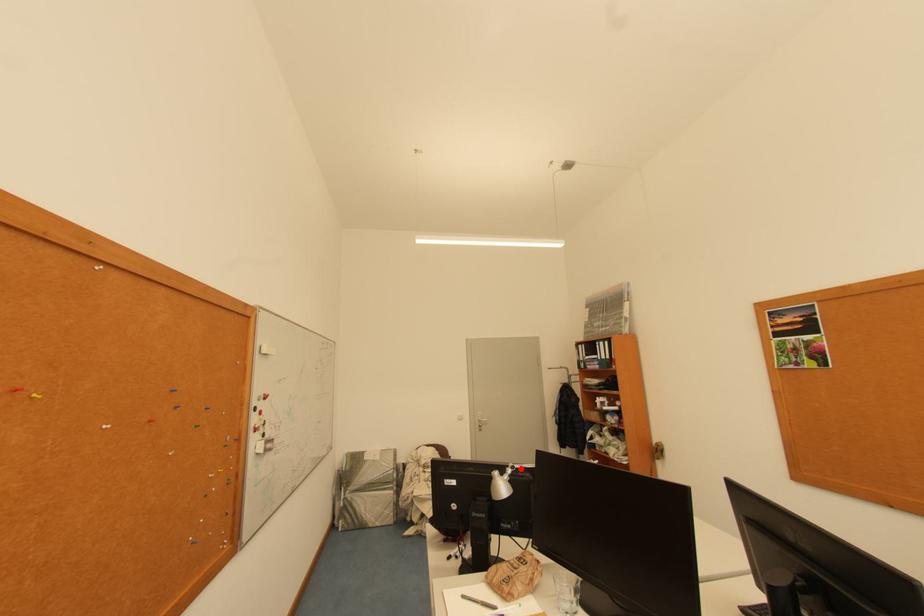
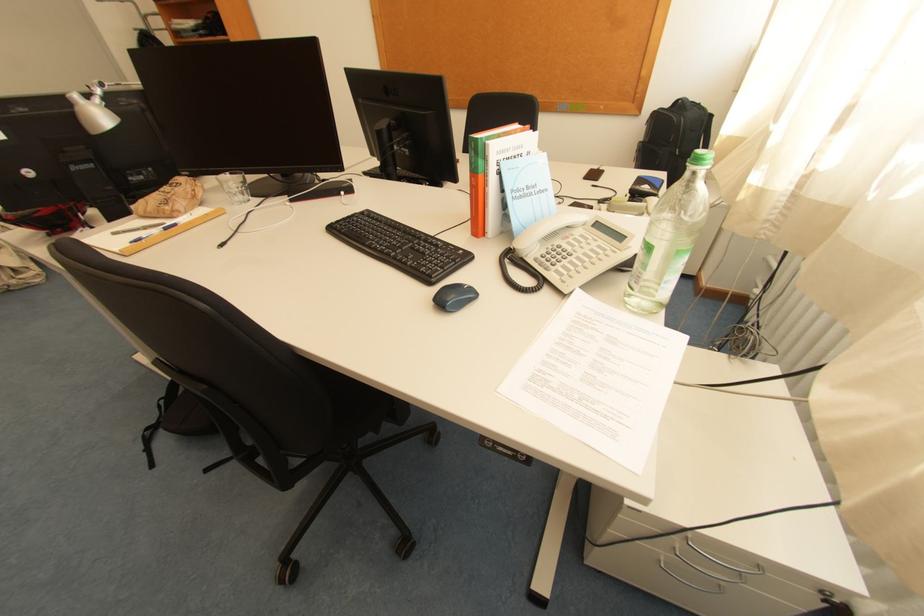
Question: I am providing you with two images of the same scene from different viewpoints. In image1, a red point is highlighted. Considering the same 3D point in image2, which of the following is correct?

Choices:
 (A) It is closer
 (B) It is farther

Answer: (B)